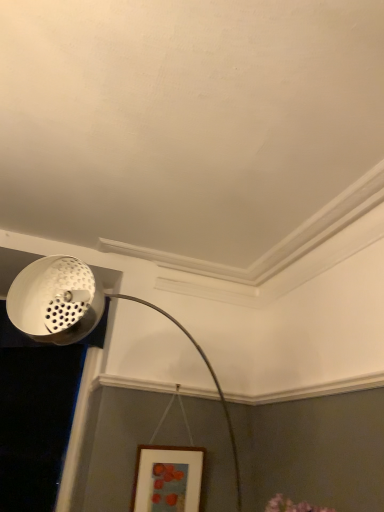
Question: Does white perforated metal at upper left have a lesser height compared to white perforated lampshade at upper left?

Choices:
 (A) no
 (B) yes

Answer: (B)

Question: From a real-world perspective, is white perforated metal at upper left physically below white perforated lampshade at upper left?

Choices:
 (A) no
 (B) yes

Answer: (A)

Question: From a real-world perspective, is white perforated metal at upper left over white perforated lampshade at upper left?

Choices:
 (A) yes
 (B) no

Answer: (A)

Question: From the image's perspective, would you say white perforated metal at upper left is shown under white perforated lampshade at upper left?

Choices:
 (A) yes
 (B) no

Answer: (B)

Question: From the image's perspective, is white perforated metal at upper left located above white perforated lampshade at upper left?

Choices:
 (A) yes
 (B) no

Answer: (A)

Question: Is point (177, 508) positioned closer to the camera than point (74, 330)?

Choices:
 (A) farther
 (B) closer

Answer: (A)

Question: Is wooden picture frame at lower center inside the boundaries of white perforated lampshade at upper left, or outside?

Choices:
 (A) inside
 (B) outside

Answer: (B)

Question: From a real-world perspective, is wooden picture frame at lower center positioned above or below white perforated lampshade at upper left?

Choices:
 (A) above
 (B) below

Answer: (B)

Question: Considering the positions of wooden picture frame at lower center and white perforated lampshade at upper left in the image, is wooden picture frame at lower center taller or shorter than white perforated lampshade at upper left?

Choices:
 (A) tall
 (B) short

Answer: (B)

Question: Considering the positions of white perforated lampshade at upper left and wooden picture frame at lower center in the image, is white perforated lampshade at upper left taller or shorter than wooden picture frame at lower center?

Choices:
 (A) tall
 (B) short

Answer: (A)

Question: Would you say white perforated lampshade at upper left is inside or outside wooden picture frame at lower center?

Choices:
 (A) outside
 (B) inside

Answer: (A)

Question: Relative to wooden picture frame at lower center, is white perforated lampshade at upper left in front or behind?

Choices:
 (A) front
 (B) behind

Answer: (A)

Question: In terms of width, does white perforated lampshade at upper left look wider or thinner when compared to wooden picture frame at lower center?

Choices:
 (A) thin
 (B) wide

Answer: (B)

Question: From the image's perspective, is white perforated metal at upper left positioned above or below white perforated lampshade at upper left?

Choices:
 (A) above
 (B) below

Answer: (A)

Question: Based on their positions, is white perforated metal at upper left located to the left or right of white perforated lampshade at upper left?

Choices:
 (A) left
 (B) right

Answer: (A)